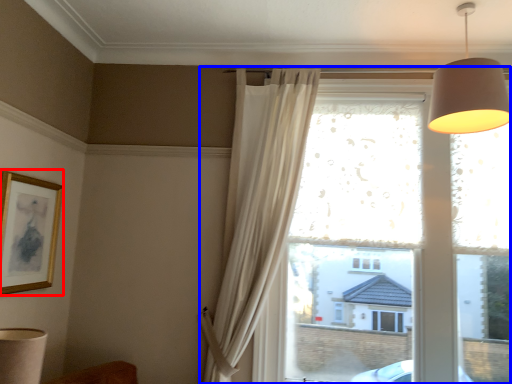
Question: Which point is further to the camera, picture frame (highlighted by a red box) or window (highlighted by a blue box)?

Choices:
 (A) picture frame
 (B) window

Answer: (B)